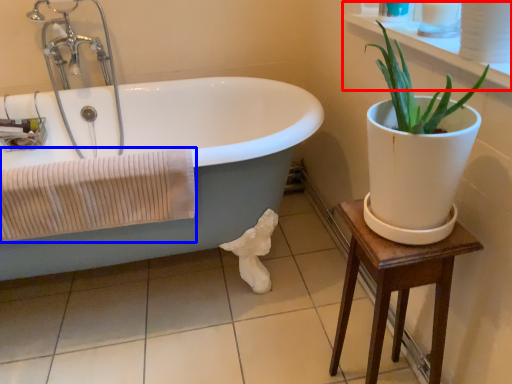
Question: Which of the following is the closest to the observer, window sill (highlighted by a red box) or bath towel (highlighted by a blue box)?

Choices:
 (A) window sill
 (B) bath towel

Answer: (A)